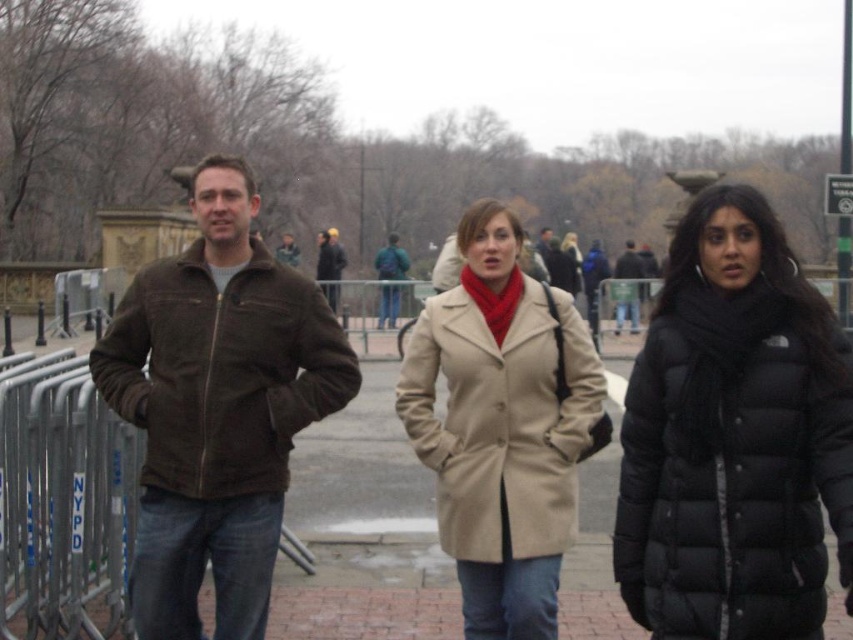
Question: From the image, what is the correct spatial relationship of black puffer coat at center in relation to dark brown leather jacket at center?

Choices:
 (A) right
 (B) left

Answer: (B)

Question: Which of the following is the closest to the observer?

Choices:
 (A) beige wool coat at center
 (B) brown suede jacket at left

Answer: (B)

Question: Is black puffer coat at center bigger than dark brown leather jacket at center?

Choices:
 (A) yes
 (B) no

Answer: (B)

Question: Which point appears closest to the camera in this image?

Choices:
 (A) click(x=569, y=490)
 (B) click(x=386, y=634)
 (C) click(x=294, y=266)

Answer: (A)

Question: Which point is closer to the camera?

Choices:
 (A) brown suede jacket at left
 (B) beige wool coat at center
 (C) brown suede jacket at center

Answer: (A)

Question: Considering the relative positions of dark brown leather jacket at center and brown suede jacket at center in the image provided, where is dark brown leather jacket at center located with respect to brown suede jacket at center?

Choices:
 (A) above
 (B) below

Answer: (B)